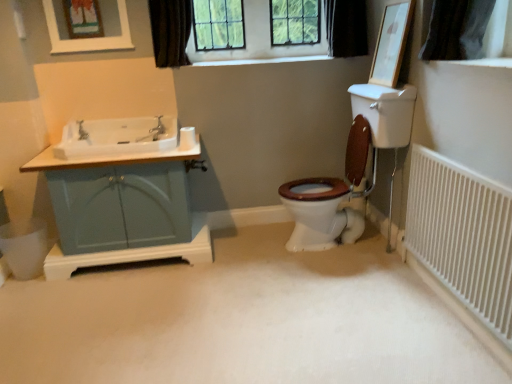
The image size is (512, 384). What do you see at coordinates (123, 209) in the screenshot? I see `matte teal cabinet at left` at bounding box center [123, 209].

What do you see at coordinates (82, 131) in the screenshot? The image size is (512, 384). I see `brushed metal faucet at left` at bounding box center [82, 131].

How much space does wooden framed artwork at upper left, the 1th picture frame positioned from the left, occupy vertically?

wooden framed artwork at upper left, the 1th picture frame positioned from the left, is 30.65 centimeters tall.

The height and width of the screenshot is (384, 512). What do you see at coordinates (463, 235) in the screenshot? I see `white metal radiator at lower right` at bounding box center [463, 235].

Identify the location of black fabric curtain at upper center, acting as the 1th curtain starting from the right. Image resolution: width=512 pixels, height=384 pixels. pyautogui.click(x=346, y=27).

From a real-world perspective, is matte teal cabinet at left positioned over wooden framed artwork at upper left, the 1th picture frame positioned from the left, based on gravity?

→ Actually, matte teal cabinet at left is physically below wooden framed artwork at upper left, the 1th picture frame positioned from the left, in the real world.

Would you say matte teal cabinet at left is to the left or to the right of wooden framed artwork at upper left, the second picture frame positioned from the right, in the picture?

In the image, matte teal cabinet at left appears on the right side of wooden framed artwork at upper left, the second picture frame positioned from the right.

Considering the sizes of matte teal cabinet at left and wooden framed artwork at upper left, the second picture frame positioned from the right, in the image, is matte teal cabinet at left wider or thinner than wooden framed artwork at upper left, the second picture frame positioned from the right,?

Considering their sizes, matte teal cabinet at left looks broader than wooden framed artwork at upper left, the second picture frame positioned from the right.

From the image's perspective, would you say matte teal cabinet at left is positioned over wooden framed artwork at upper left, the 1th picture frame positioned from the left?

No, from the image's perspective, matte teal cabinet at left is not over wooden framed artwork at upper left, the 1th picture frame positioned from the left.

Is wooden framed artwork at upper left, the 1th picture frame positioned from the left, looking in the opposite direction of white matte carpet at center?

No, wooden framed artwork at upper left, the 1th picture frame positioned from the left, is not facing away from white matte carpet at center.

Relative to white matte carpet at center, is wooden framed artwork at upper left, the 1th picture frame positioned from the left, in front or behind?

wooden framed artwork at upper left, the 1th picture frame positioned from the left, is positioned farther from the viewer than white matte carpet at center.

Which object is wider, wooden framed artwork at upper left, the 1th picture frame positioned from the left, or white matte carpet at center?

white matte carpet at center is wider.

From the image's perspective, is wooden framed artwork at upper left, the 1th picture frame positioned from the left, above or below white matte carpet at center?

From the image's perspective, wooden framed artwork at upper left, the 1th picture frame positioned from the left, appears above white matte carpet at center.

Does white metal radiator at lower right appear on the left side of wooden framed artwork at upper left, the 1th picture frame positioned from the left?

No.

Can you tell me how much white metal radiator at lower right and wooden framed artwork at upper left, the 1th picture frame positioned from the left, differ in facing direction?

white metal radiator at lower right and wooden framed artwork at upper left, the 1th picture frame positioned from the left, are facing 89.8 degrees away from each other.

This screenshot has width=512, height=384. I want to click on radiator that appears below the wooden framed artwork at upper left, the second picture frame positioned from the right (from the image's perspective), so click(x=463, y=235).

From the image's perspective, between white metal radiator at lower right and wooden framed artwork at upper left, the second picture frame positioned from the right, which one is located above?

wooden framed artwork at upper left, the second picture frame positioned from the right, from the image's perspective.

Can you confirm if white metal radiator at lower right is positioned to the left of brushed metal faucet at left?

In fact, white metal radiator at lower right is to the right of brushed metal faucet at left.

Does white metal radiator at lower right have a greater width compared to brushed metal faucet at left?

No.

You are a GUI agent. You are given a task and a screenshot of the screen. Output one action in this format:
    pyautogui.click(x=<x>, y=<y>)
    Task: Click on the radiator below the brushed metal faucet at left (from a real-world perspective)
    The width and height of the screenshot is (512, 384).
    Given the screenshot: What is the action you would take?
    pyautogui.click(x=463, y=235)

Based on the photo, considering the relative sizes of white metal radiator at lower right and brushed metal faucet at left in the image provided, is white metal radiator at lower right bigger than brushed metal faucet at left?

Indeed, white metal radiator at lower right has a larger size compared to brushed metal faucet at left.

Is wooden picture frame at upper right, which is counted as the second picture frame, starting from the left, directly adjacent to matte teal cabinet at left?

No, wooden picture frame at upper right, which is counted as the second picture frame, starting from the left, is not in contact with matte teal cabinet at left.

Which object is closer to the camera, wooden picture frame at upper right, which is counted as the second picture frame, starting from the left, or matte teal cabinet at left?

wooden picture frame at upper right, which is counted as the second picture frame, starting from the left, is in front.

Is wooden picture frame at upper right, which ranks as the first picture frame in right-to-left order, situated inside matte teal cabinet at left or outside?

wooden picture frame at upper right, which ranks as the first picture frame in right-to-left order, cannot be found inside matte teal cabinet at left.

From the image's perspective, is dark fabric curtain at upper center, the first curtain in the left-to-right sequence, located above or below white glossy sink at left?

dark fabric curtain at upper center, the first curtain in the left-to-right sequence, is situated higher than white glossy sink at left in the image.

From a real-world perspective, is dark fabric curtain at upper center, the first curtain in the left-to-right sequence, positioned under white glossy sink at left based on gravity?

No, from a real-world perspective, dark fabric curtain at upper center, the first curtain in the left-to-right sequence, is not below white glossy sink at left.

Considering the points (156, 13) and (162, 150), which point is behind, point (156, 13) or point (162, 150)?

The point (156, 13) is behind.

Looking at this image, which is correct: dark fabric curtain at upper center, the first curtain in the left-to-right sequence, is inside white glossy sink at left, or outside of it?

The correct answer is: outside.

Does white matte toilet paper at upper center come behind white metal radiator at lower right?

Yes, white matte toilet paper at upper center is further from the viewer.

Based on their positions, is white matte toilet paper at upper center located to the left or right of white metal radiator at lower right?

white matte toilet paper at upper center is to the left of white metal radiator at lower right.

Consider the image. Is white metal radiator at lower right at the back of white matte toilet paper at upper center?

white matte toilet paper at upper center does not have its back to white metal radiator at lower right.

From a real-world perspective, is white matte toilet paper at upper center above or below white metal radiator at lower right?

white matte toilet paper at upper center is situated higher than white metal radiator at lower right in the real world.

Locate an element on the screen. The width and height of the screenshot is (512, 384). picture frame behind the matte teal cabinet at left is located at coordinates (88, 39).

From a real-world perspective, which picture frame is the 2nd one above the white matte carpet at center? Please provide its 2D coordinates.

[(88, 39)]

Which object lies nearer to the anchor point white matte toilet paper at upper center, brushed metal faucet at left or clear glass window at upper center?

clear glass window at upper center.

From the image, which object appears to be nearer to brushed metal faucet at left, white metal radiator at lower right or black fabric curtain at upper center, the 2th curtain in the left-to-right sequence?

black fabric curtain at upper center, the 2th curtain in the left-to-right sequence, is positioned closer to the anchor brushed metal faucet at left.

Looking at the image, which one is located further to white metal radiator at lower right, wooden framed artwork at upper left, the 1th picture frame positioned from the left, or dark fabric curtain at upper center, the first curtain in the left-to-right sequence?

wooden framed artwork at upper left, the 1th picture frame positioned from the left, is further to white metal radiator at lower right.

Considering their positions, is black fabric curtain at upper center, the 2th curtain in the left-to-right sequence, positioned closer to brushed metal faucet at left than wooden picture frame at upper right, which ranks as the first picture frame in right-to-left order?

The object closer to brushed metal faucet at left is black fabric curtain at upper center, the 2th curtain in the left-to-right sequence.

Looking at the image, which one is located further to white glossy sink at left, wooden picture frame at upper right, which ranks as the first picture frame in right-to-left order, or matte teal cabinet at left?

wooden picture frame at upper right, which ranks as the first picture frame in right-to-left order, is positioned further to the anchor white glossy sink at left.

Looking at the image, which one is located closer to wooden framed artwork at upper left, the second picture frame positioned from the right, matte teal cabinet at left or black fabric curtain at upper center, acting as the 1th curtain starting from the right?

matte teal cabinet at left is positioned closer to the anchor wooden framed artwork at upper left, the second picture frame positioned from the right.

Considering their positions, is wooden picture frame at upper right, which ranks as the first picture frame in right-to-left order, positioned closer to matte teal cabinet at left than black fabric curtain at upper center, acting as the 1th curtain starting from the right?

Based on the image, wooden picture frame at upper right, which ranks as the first picture frame in right-to-left order, appears to be nearer to matte teal cabinet at left.

Based on their spatial positions, is dark fabric curtain at upper center, the second curtain positioned from the right, or matte teal cabinet at left further from black fabric curtain at upper center, the 2th curtain in the left-to-right sequence?

Among the two, matte teal cabinet at left is located further to black fabric curtain at upper center, the 2th curtain in the left-to-right sequence.

Identify the location of sink located between wooden framed artwork at upper left, the 1th picture frame positioned from the left, and black fabric curtain at upper center, the 2th curtain in the left-to-right sequence, in the left-right direction. This screenshot has width=512, height=384. (117, 136).

Locate an element on the screen. The image size is (512, 384). curtain between black fabric curtain at upper center, the 2th curtain in the left-to-right sequence, and white metal radiator at lower right in the up-down direction is located at coordinates (170, 31).

The image size is (512, 384). Find the location of `picture frame between white matte toilet paper at upper center and white metal radiator at lower right`. picture frame between white matte toilet paper at upper center and white metal radiator at lower right is located at coordinates (391, 43).

I want to click on window between wooden framed artwork at upper left, the 1th picture frame positioned from the left, and white metal radiator at lower right, in the horizontal direction, so click(170, 31).